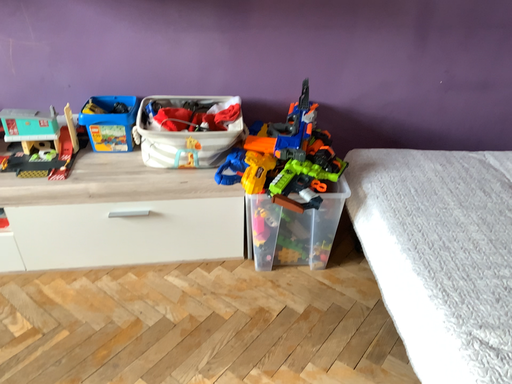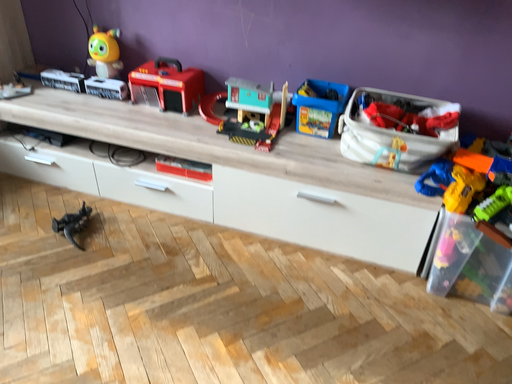
Question: Which way did the camera rotate in the video?

Choices:
 (A) rotated left
 (B) rotated right

Answer: (A)